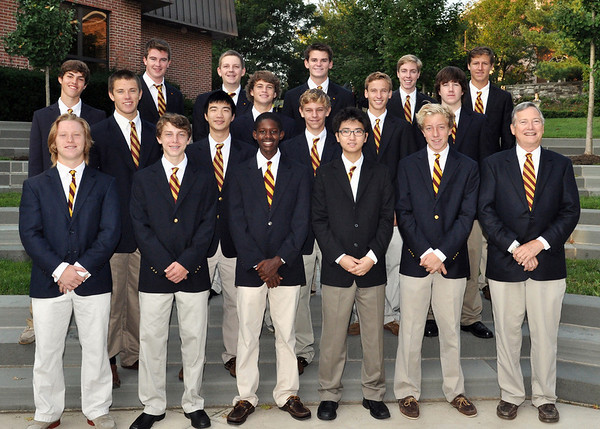
What are the coordinates of `brick wall` in the screenshot? It's located at (126, 35), (190, 47).